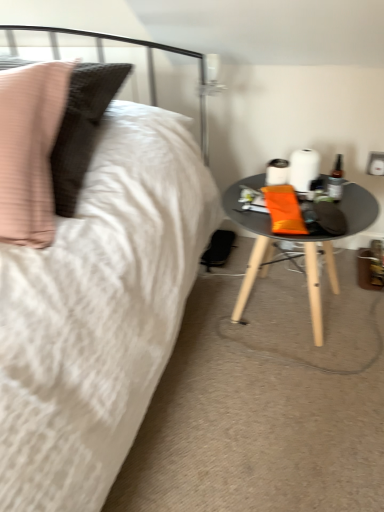
Where is `free space below matte black table at lower right (from a real-world perspective)`? This screenshot has height=512, width=384. free space below matte black table at lower right (from a real-world perspective) is located at coordinates (279, 312).